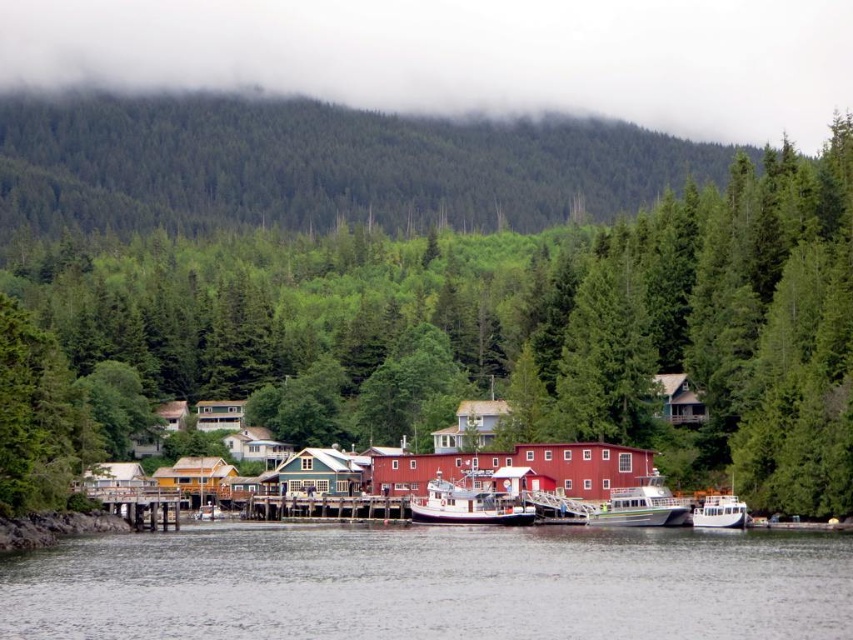
You are standing at the edge of the waterfront and want to take a photo of the green textured tree at center. If your camera has a maximum zoom range of 100 meters, will you be able to capture the tree clearly without moving closer?

The green textured tree at center and viewer are 88.70 meters apart from each other. Since the camera can zoom up to 100 meters, you can capture the tree clearly without moving closer.

You are standing at the wooden pier and see two points in the water. The first point is located at coordinates point (473, 506) and the second point is at point (592, 509). Which point is closer to you?

Point (592, 509) is closer to you because point (473, 506) is behind it.

You are a photographer standing on the wooden pier and want to capture both the white wooden boat at center and the white glossy boat at lower center in a single photo. Which boat should you move closer to in order to include both in your shot?

You should move closer to the white wooden boat at center because the white glossy boat at lower center is behind it, so moving closer to the front boat will allow both to be in the frame without the back boat being obscured.